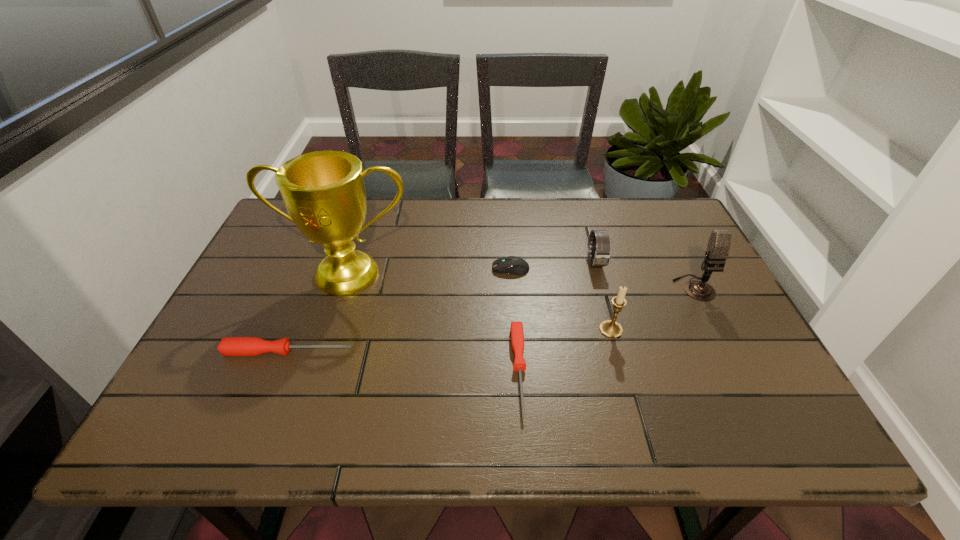
This screenshot has height=540, width=960. Find the location of `free region located on the back of the third tallest object`. free region located on the back of the third tallest object is located at coordinates (600, 290).

Locate an element on the screen. vacant space situated on the front-facing side of the microphone is located at coordinates (720, 338).

This screenshot has width=960, height=540. Identify the location of free space located on the button of the computer equipment. (442, 268).

Where is `vacant space located on the button of the computer equipment`? vacant space located on the button of the computer equipment is located at coordinates (374, 268).

Identify the location of free region located 0.400m on the button of the computer equipment. The height and width of the screenshot is (540, 960). (349, 268).

Find the location of a particular element. The height and width of the screenshot is (540, 960). vacant space located 0.110m on the shiny surface of the tallest object is located at coordinates (331, 332).

Identify the location of free location located 0.130m on the face of the fourth tallest object. (610, 310).

The height and width of the screenshot is (540, 960). I want to click on object positioned at the near edge, so click(x=516, y=331).

This screenshot has height=540, width=960. I want to click on screwdriver that is at the left edge, so click(x=230, y=346).

The image size is (960, 540). Identify the location of award that is at the left edge. (324, 192).